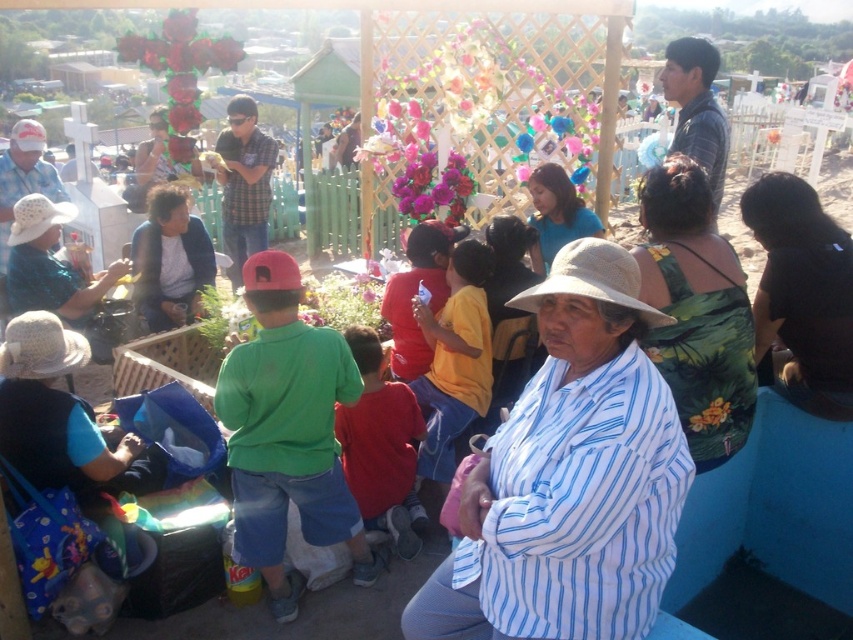
Question: Which point is farther to the camera?

Choices:
 (A) white woven hat at left
 (B) matte blue sweater at center
 (C) green floral dress at center
 (D) yellow matte shirt at center

Answer: (B)

Question: From the image, what is the correct spatial relationship of white striped shirt at center in relation to white fabric hat at upper left?

Choices:
 (A) below
 (B) above

Answer: (A)

Question: Does white striped shirt at center have a smaller size compared to white woven hat at left?

Choices:
 (A) yes
 (B) no

Answer: (B)

Question: Can you confirm if green floral dress at center is positioned below matte blue sweater at center?

Choices:
 (A) no
 (B) yes

Answer: (B)

Question: Considering the real-world distances, which object is closest to the white straw hat at center?

Choices:
 (A) blue fabric dress at center
 (B) green floral dress at center
 (C) black fabric cap at center
 (D) white straw hat at lower left

Answer: (B)

Question: Which of the following is the farthest from the observer?

Choices:
 (A) black fabric at lower right
 (B) red cotton shirt at center

Answer: (B)